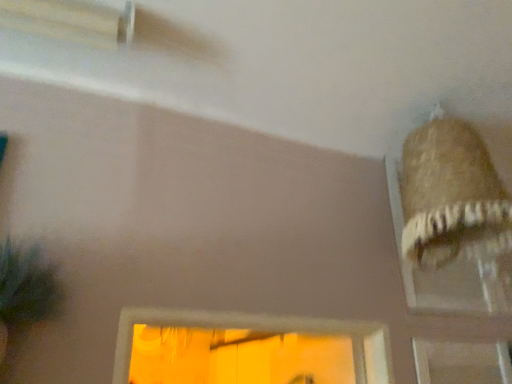
This screenshot has width=512, height=384. Identify the location of brown textured skull at upper right. (451, 196).

Describe the element at coordinates (451, 196) in the screenshot. The width and height of the screenshot is (512, 384). I see `brown textured skull at upper right` at that location.

In order to face brown textured skull at upper right, should I rotate leftwards or rightwards?

You should rotate right by 27.004 degrees.

Where is `brown textured skull at upper right`? brown textured skull at upper right is located at coordinates (451, 196).